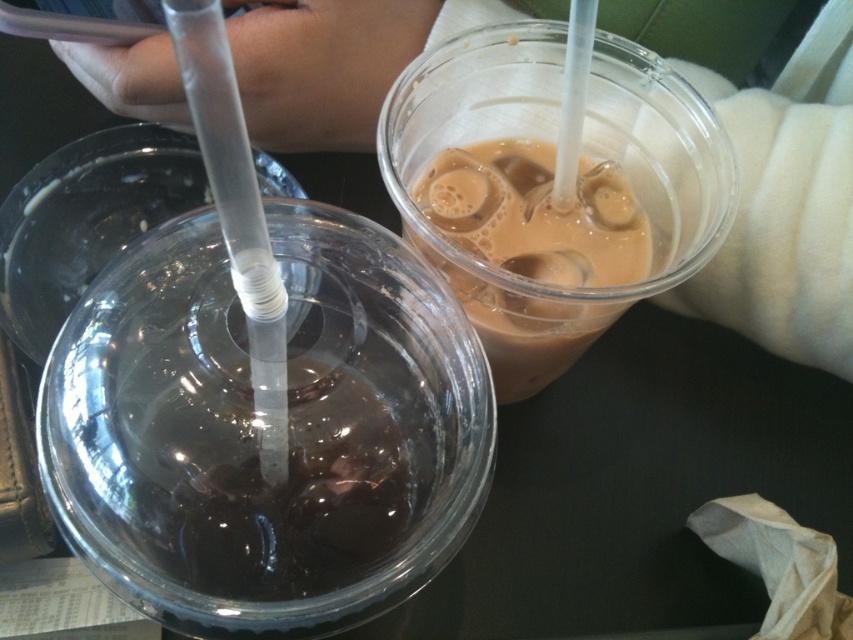
You are a bartender and need to reach for the brown matte plastic cup at upper right. Is the skinny white arm at upper center blocking your access to it?

The skinny white arm at upper center is positioned over brown matte plastic cup at upper right, so it is blocking access to the cup.

From the picture: You are a bartender who needs to reach for the brown matte plastic cup at upper right without touching the skinny white arm at upper center. Can you do this easily?

The skinny white arm at upper center is positioned on the left side of the brown matte plastic cup at upper right, so there is space to the right of the arm to reach the cup without touching it.

You are at a table with two cups. There is a point marked at coordinates (x=781, y=227). What object does this point correspond to?

The point at coordinates (x=781, y=227) corresponds to the skinny white arm at upper center.